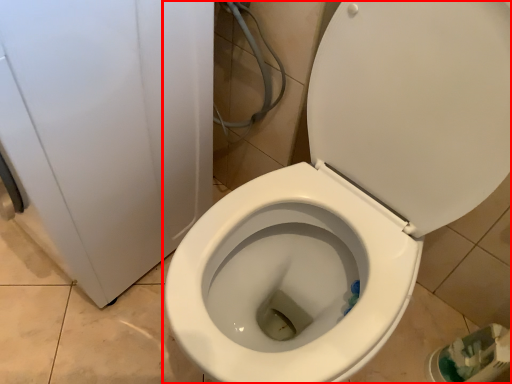
Question: In this image, where is toilet (annotated by the red box) located relative to porcelain?

Choices:
 (A) right
 (B) left

Answer: (A)